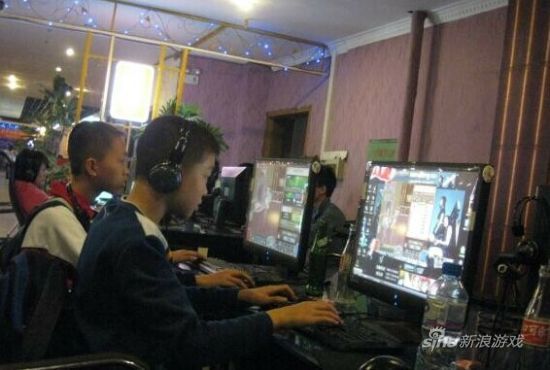
Where is `displays`? displays is located at coordinates (x=412, y=225), (x=274, y=209), (x=226, y=187).